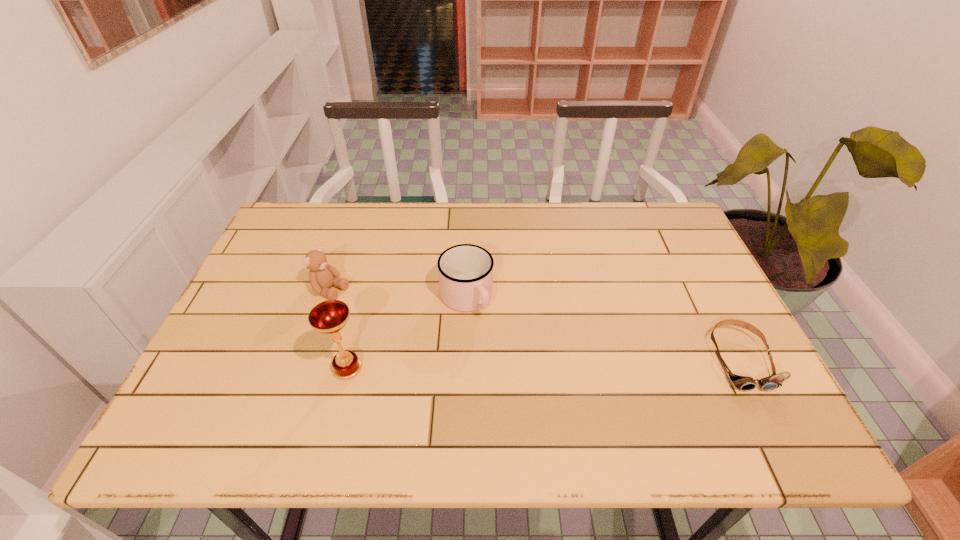
Find the location of a particular element. free space located 0.110m on the side of the second object from right to left with the handle is located at coordinates (499, 354).

The height and width of the screenshot is (540, 960). What are the coordinates of `blank space located 0.150m on the side of the second object from right to left with the handle` in the screenshot? It's located at 507,367.

In order to click on blank space located 0.160m on the side of the second object from right to left with the handle in this screenshot , I will do `click(510, 370)`.

At what (x,y) coordinates should I click in order to perform the action: click on chalice that is at the near edge. Please return your answer as a coordinate pair (x, y). Looking at the image, I should click on (329, 317).

You are a GUI agent. You are given a task and a screenshot of the screen. Output one action in this format:
    pyautogui.click(x=<x>, y=<y>)
    Task: Click on the goggles positioned at the near edge
    The height and width of the screenshot is (540, 960).
    Given the screenshot: What is the action you would take?
    pyautogui.click(x=744, y=383)

The height and width of the screenshot is (540, 960). What are the coordinates of `object present at the right edge` in the screenshot? It's located at coord(744,383).

Where is `object that is at the near right corner`? object that is at the near right corner is located at coordinates (744, 383).

In the image, there is a desktop. Identify the location of blank space at the far edge. The width and height of the screenshot is (960, 540). (360, 228).

In the image, there is a desktop. At what (x,y) coordinates should I click in order to perform the action: click on vacant area at the left edge. Please return your answer as a coordinate pair (x, y). Looking at the image, I should click on (237, 320).

Identify the location of vacant space at the right edge of the desktop. Image resolution: width=960 pixels, height=540 pixels. (689, 363).